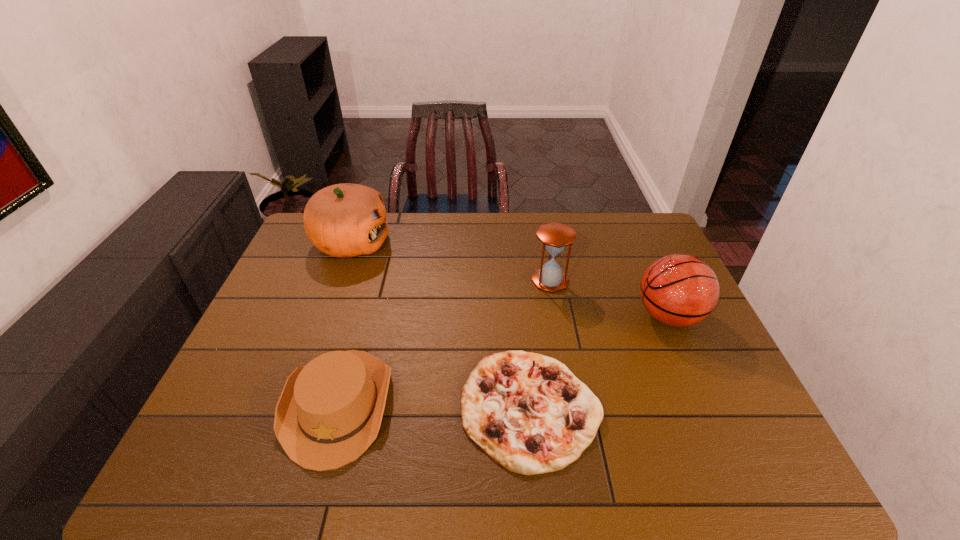
Identify the location of free location located on the back of the pizza. This screenshot has width=960, height=540. (516, 266).

The height and width of the screenshot is (540, 960). I want to click on object that is positioned at the far edge, so click(x=344, y=220).

Where is `cowboy hat that is at the near edge`? The height and width of the screenshot is (540, 960). cowboy hat that is at the near edge is located at coordinates (329, 412).

Identify the location of pizza that is at the near edge. (529, 413).

You are a GUI agent. You are given a task and a screenshot of the screen. Output one action in this format:
    pyautogui.click(x=<x>, y=<y>)
    Task: Click on the object that is at the left edge
    Image resolution: width=960 pixels, height=540 pixels.
    Given the screenshot: What is the action you would take?
    pyautogui.click(x=344, y=220)

The height and width of the screenshot is (540, 960). Find the location of `object present at the right edge`. object present at the right edge is located at coordinates (680, 290).

The image size is (960, 540). I want to click on object positioned at the far left corner, so click(x=344, y=220).

In the image, there is a desktop. Where is `free space at the far edge`? The height and width of the screenshot is (540, 960). free space at the far edge is located at coordinates (608, 238).

Where is `vacant point at the near edge`? The height and width of the screenshot is (540, 960). vacant point at the near edge is located at coordinates (484, 472).

Find the location of `free region at the left edge of the desktop`. free region at the left edge of the desktop is located at coordinates (269, 331).